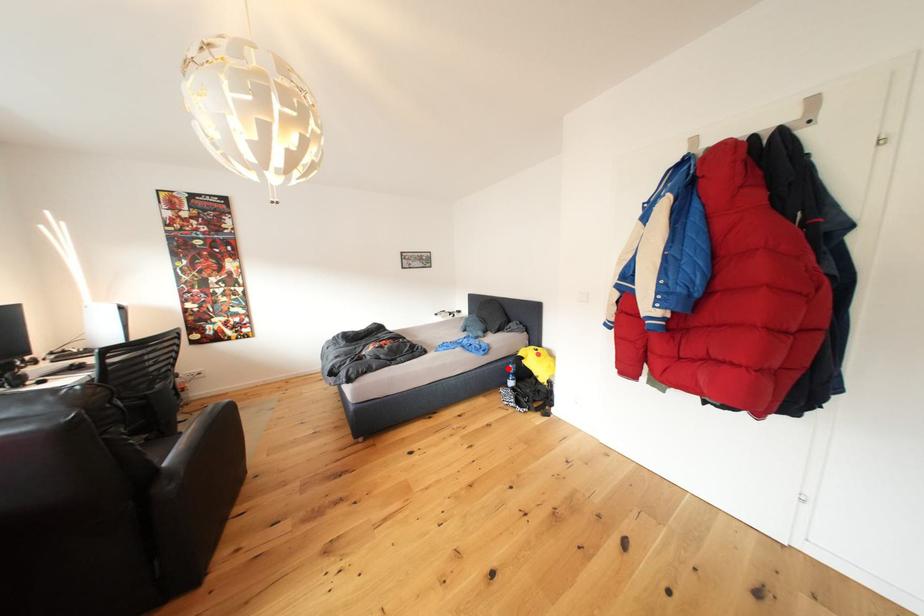
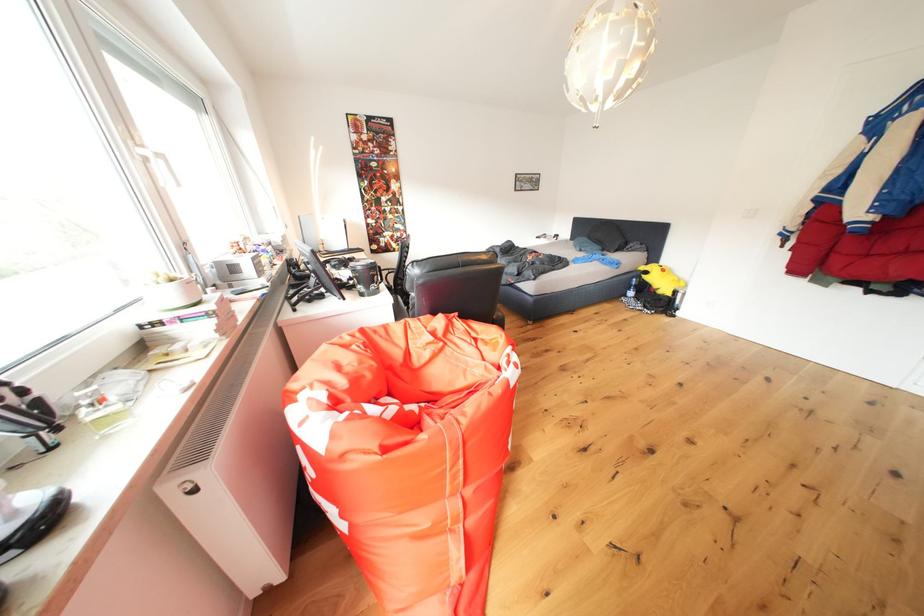
Question: I am providing you with two images of the same scene from different viewpoints. In image1, a red point is highlighted. Considering the same 3D point in image2, which of the following is correct?

Choices:
 (A) It is closer
 (B) It is farther

Answer: (A)